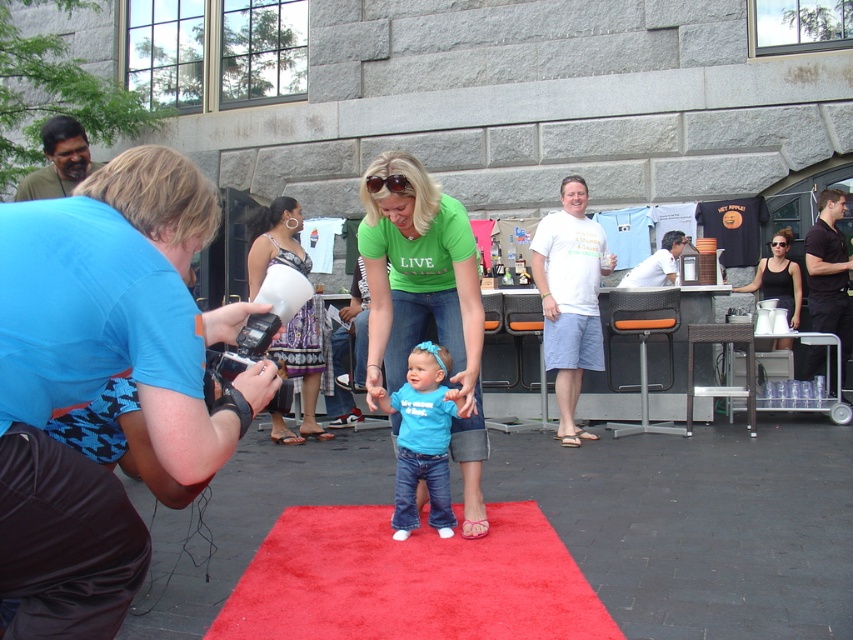
Image resolution: width=853 pixels, height=640 pixels. Describe the element at coordinates (103, 380) in the screenshot. I see `blue fabric camera at left` at that location.

I want to click on blue fabric camera at left, so click(103, 380).

Find the location of a particular element. The width and height of the screenshot is (853, 640). blue fabric camera at left is located at coordinates (103, 380).

You are a GUI agent. You are given a task and a screenshot of the screen. Output one action in this format:
    pyautogui.click(x=<x>, y=<y>)
    Task: Click on the blue fabric camera at left
    The image size is (853, 640).
    Given the screenshot: What is the action you would take?
    pyautogui.click(x=103, y=380)

Is white cotton t-shirt at center further to camera compared to white shirt at center?

That is False.

Does point (558, 380) come in front of point (660, 264)?

Yes, point (558, 380) is in front of point (660, 264).

The height and width of the screenshot is (640, 853). Find the location of `white cotton t-shirt at center`. white cotton t-shirt at center is located at coordinates coord(569,298).

Does white cotton t-shirt at center appear over black smooth t-shirt at right?

Actually, white cotton t-shirt at center is below black smooth t-shirt at right.

Does white cotton t-shirt at center come in front of black smooth t-shirt at right?

Yes.

This screenshot has height=640, width=853. What do you see at coordinates (569, 298) in the screenshot?
I see `white cotton t-shirt at center` at bounding box center [569, 298].

Locate an element on the screen. The image size is (853, 640). white cotton t-shirt at center is located at coordinates (569, 298).